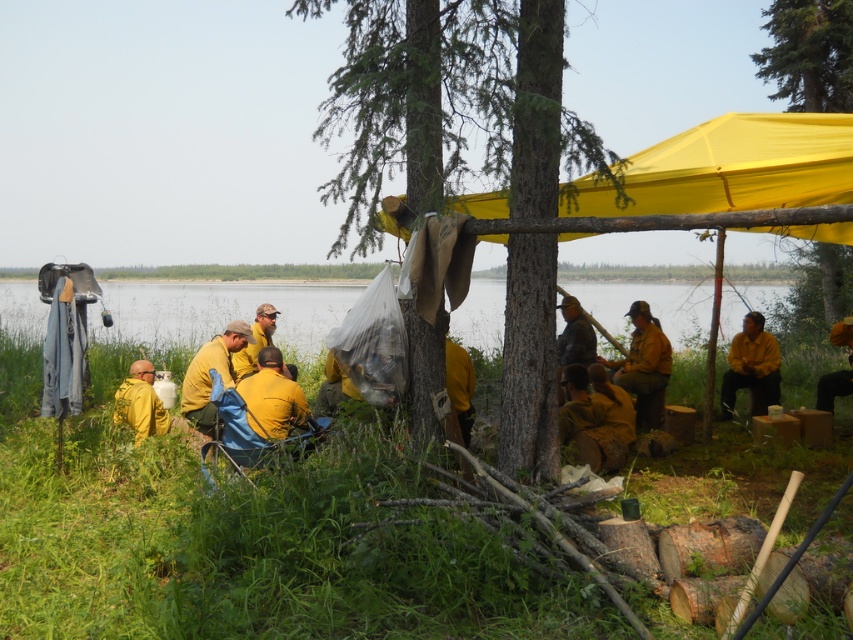
You are standing at the origin point of the coordinate system in the image. The origin is at the bottom left corner of the image. You want to locate the matte yellow uniform at center. Which direction should you move from the origin to reach it?

To locate the matte yellow uniform at center, you should move towards the right and upwards from the origin since its coordinates are at point 0.572 on the x axis and 0.755 on the y axis, which is to the right and above the origin point.

You are a hiker who has just arrived at the campsite and need to locate two items. You see the matte yellow uniform at center and the brown leather jacket at center. Which one is positioned to the right of the other?

The matte yellow uniform at center is positioned to the right of the brown leather jacket at center.